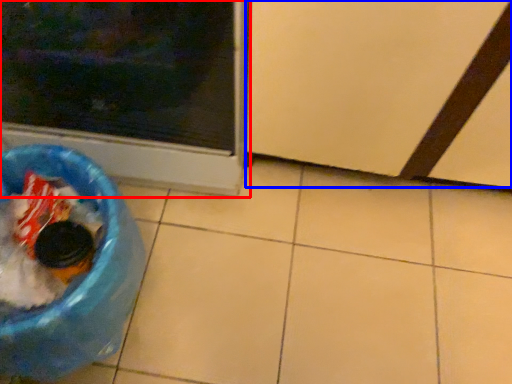
Question: Among these objects, which one is farthest to the camera, home appliance (highlighted by a red box) or screen door (highlighted by a blue box)?

Choices:
 (A) home appliance
 (B) screen door

Answer: (B)